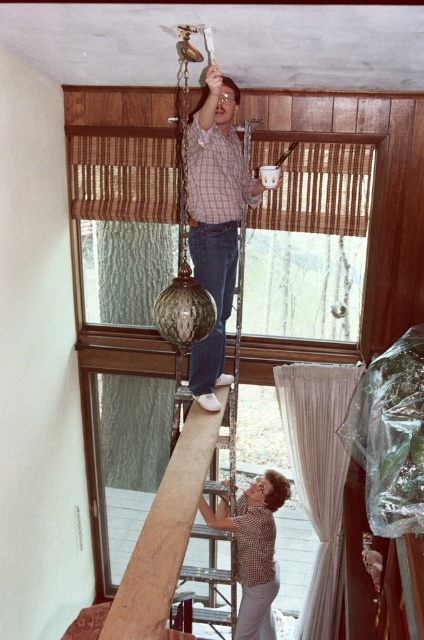
You are standing in the room and want to reach the point at coordinates point (351, 369). The ladder in the scene is 3.5 meters tall. Can you safely use the ladder to reach that point?

The point (351, 369) is 4.15 meters from the viewer. The ladder is only 3.5 meters tall, so it is not tall enough to safely reach that point.

You are a contractor measuring the distance between the sheer white curtain at lower right and the checkered shirt at center for a project. The minimum required distance for safety standards is 16 inches. Is the current distance compliant?

The sheer white curtain at lower right and checkered shirt at center are 16.59 inches apart, which exceeds the minimum required 16 inches for safety standards. Therefore, the current distance is compliant.